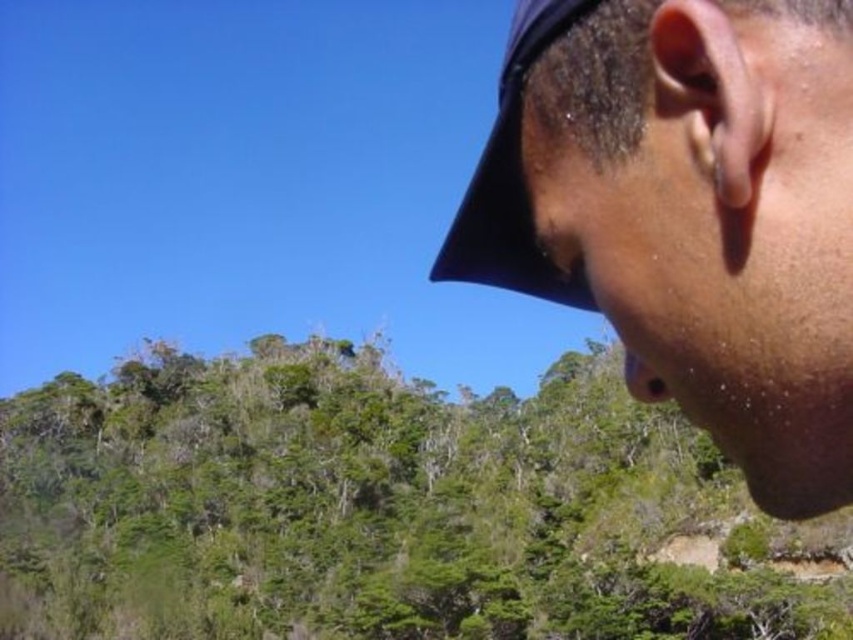
You are a photographer trying to capture a portrait of the person wearing the black fabric baseball hat at upper right. The green leafy trees at center are blocking the sunlight needed for the perfect shot. Can you adjust your position to ensure the hat is well lit without the trees obscuring the light?

The green leafy trees at center are much taller than the black fabric baseball hat at upper right. By positioning yourself so the sunlight comes from behind the trees, their height will allow light to pass over them and illuminate the hat effectively.

You are a photographer trying to capture the green leafy trees at center and the matte black cap at upper right in a single frame. Which object should you zoom in on to ensure both are visible without moving your position?

You should zoom in on the matte black cap at upper right because the green leafy trees at center are wider than the matte black cap at upper right, so focusing on the wider object might help include both in the frame.